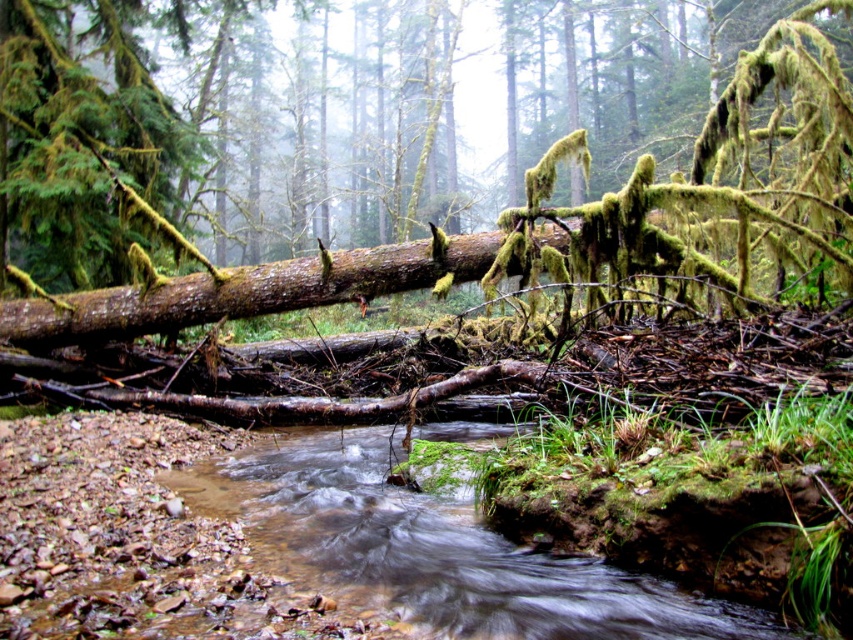
Can you confirm if brown mossy log at center is positioned to the right of moss-covered wood at center?

Yes, brown mossy log at center is to the right of moss-covered wood at center.

At what (x,y) coordinates should I click in order to perform the action: click on brown mossy log at center. Please return your answer as a coordinate pair (x, y). Looking at the image, I should click on (326, 129).

You are a GUI agent. You are given a task and a screenshot of the screen. Output one action in this format:
    pyautogui.click(x=<x>, y=<y>)
    Task: Click on the brown mossy log at center
    The image size is (853, 640).
    Given the screenshot: What is the action you would take?
    pyautogui.click(x=326, y=129)

Between point (404, 545) and point (328, 262), which one is positioned behind?

Positioned behind is point (328, 262).

Is clear water at center above moss-covered wood at center?

Actually, clear water at center is below moss-covered wood at center.

Between point (584, 621) and point (485, 236), which one is positioned in front?

Point (584, 621) is more forward.

Locate an element on the screen. Image resolution: width=853 pixels, height=640 pixels. clear water at center is located at coordinates (434, 548).

Does brown mossy log at center have a greater height compared to clear water at center?

Yes.

Is point (531, 44) closer to camera compared to point (474, 602)?

No, it is not.

Which is behind, point (592, 161) or point (509, 545)?

Point (592, 161)

You are a GUI agent. You are given a task and a screenshot of the screen. Output one action in this format:
    pyautogui.click(x=<x>, y=<y>)
    Task: Click on the brown mossy log at center
    The height and width of the screenshot is (640, 853).
    Given the screenshot: What is the action you would take?
    pyautogui.click(x=326, y=129)